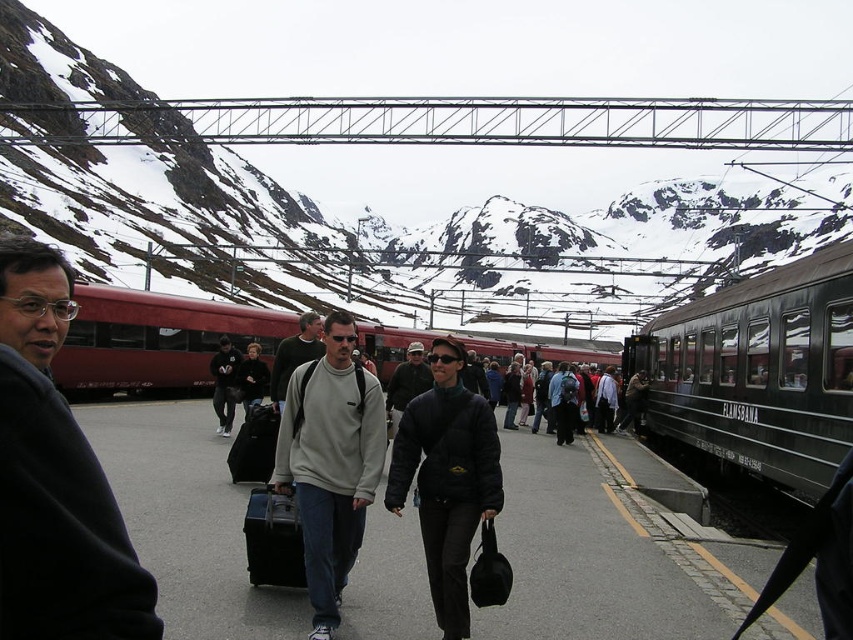
Question: Does snowy rock at upper center appear on the right side of light gray sweater at center?

Choices:
 (A) yes
 (B) no

Answer: (A)

Question: Which object is the closest to the dark blue softshell jacket at center?

Choices:
 (A) dark gray sweater at left
 (B) dark gray jacket at center
 (C) black metal train at right
 (D) black matte suitcase at center

Answer: (B)

Question: Does light gray sweater at center have a lesser width compared to dark gray jacket at center?

Choices:
 (A) no
 (B) yes

Answer: (A)

Question: Is light gray sweatshirt at center positioned at the back of dark blue softshell jacket at center?

Choices:
 (A) no
 (B) yes

Answer: (A)

Question: Which of the following is the closest to the observer?

Choices:
 (A) black matte suitcase at center
 (B) dark blue softshell jacket at center
 (C) matte black suitcase at center

Answer: (B)

Question: Among these points, which one is farthest from the camera?

Choices:
 (A) (166, 390)
 (B) (49, 353)
 (C) (254, 465)
 (D) (276, 381)

Answer: (A)